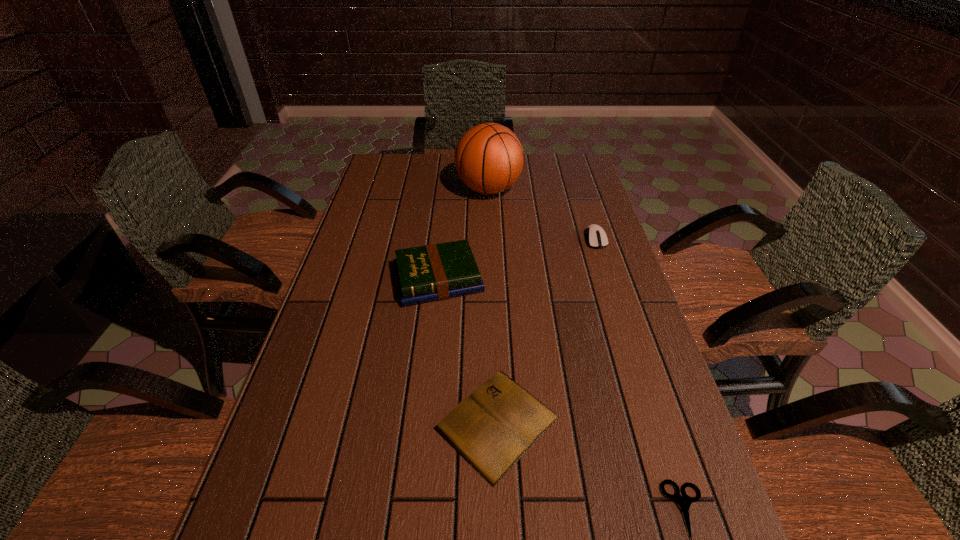
At what (x,y) coordinates should I click in order to perform the action: click on free location located on the front of the mouse. Please return your answer as a coordinate pair (x, y). The height and width of the screenshot is (540, 960). Looking at the image, I should click on (631, 349).

The height and width of the screenshot is (540, 960). What are the coordinates of `free space located on the back of the nearer book` in the screenshot? It's located at (492, 278).

The image size is (960, 540). I want to click on object at the far edge, so click(489, 158).

Find the location of a particular element. Image resolution: width=960 pixels, height=540 pixels. object that is at the right edge is located at coordinates (596, 237).

This screenshot has height=540, width=960. In the image, there is a desktop. What are the coordinates of `vacant space at the far edge` in the screenshot? It's located at (543, 173).

Identify the location of vacant space at the left edge. (365, 220).

In the image, there is a desktop. Identify the location of vacant space at the right edge. The image size is (960, 540). (648, 499).

At what (x,y) coordinates should I click in order to perform the action: click on free region at the far left corner of the desktop. Please return your answer as a coordinate pair (x, y). The width and height of the screenshot is (960, 540). Looking at the image, I should click on (411, 185).

You are a GUI agent. You are given a task and a screenshot of the screen. Output one action in this format:
    pyautogui.click(x=<x>, y=<y>)
    Task: Click on the vacant space at the far right corner of the desktop
    This screenshot has width=960, height=540.
    Given the screenshot: What is the action you would take?
    pyautogui.click(x=547, y=157)

The height and width of the screenshot is (540, 960). Find the location of `free space between the mouse and the nearer book`. free space between the mouse and the nearer book is located at coordinates (546, 331).